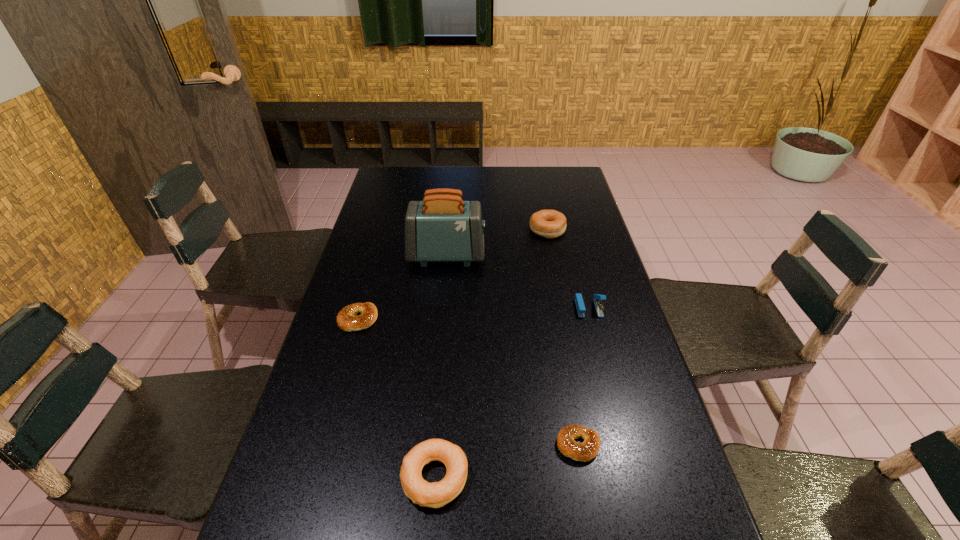
Find the location of a particular element. The image size is (960, 540). toaster is located at coordinates (442, 228).

You are a GUI agent. You are given a task and a screenshot of the screen. Output one action in this format:
    pyautogui.click(x=<x>, y=<y>)
    Task: Click on the fifth nearest object
    
    Given the screenshot: What is the action you would take?
    pyautogui.click(x=442, y=228)

The height and width of the screenshot is (540, 960). I want to click on stapler, so click(579, 302).

Where is `the farthest object`? the farthest object is located at coordinates (550, 224).

I want to click on the farthest bagel, so click(x=550, y=224).

I want to click on the fourth tallest object, so click(437, 494).

Where is `the third bagel from right to left`? the third bagel from right to left is located at coordinates (437, 494).

In order to click on the third nearest bagel in this screenshot , I will do `click(347, 319)`.

Locate an element on the screen. The image size is (960, 540). the leftmost object is located at coordinates (347, 319).

At what (x,y) coordinates should I click in order to perform the action: click on the shortest object. Please return your answer as a coordinate pair (x, y). Looking at the image, I should click on (588, 449).